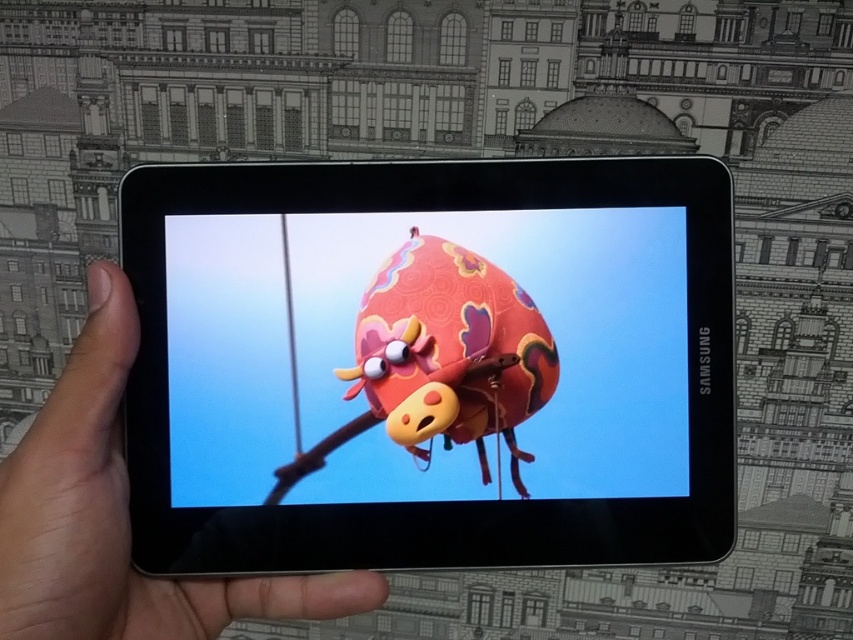
Question: Which of the following is the farthest from the observer?

Choices:
 (A) matte black tablet at center
 (B) black glossy tablet at center

Answer: (B)

Question: Does black glossy tablet at center appear on the left side of matte black tablet at center?

Choices:
 (A) no
 (B) yes

Answer: (A)

Question: Which of the following is the farthest from the observer?

Choices:
 (A) (334, 445)
 (B) (328, 609)

Answer: (A)

Question: Considering the relative positions of black glossy tablet at center and matte black tablet at center in the image provided, where is black glossy tablet at center located with respect to matte black tablet at center?

Choices:
 (A) left
 (B) right

Answer: (B)

Question: Does black glossy tablet at center have a larger size compared to matte black tablet at center?

Choices:
 (A) yes
 (B) no

Answer: (B)